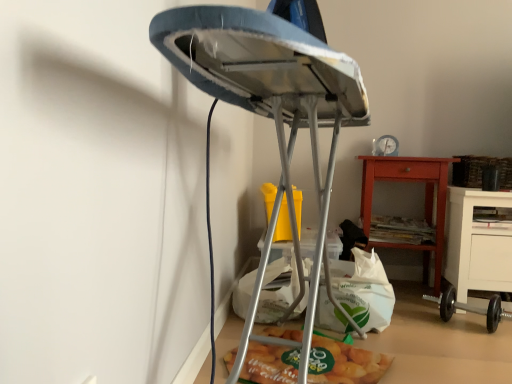
Question: From a real-world perspective, is matte plastic bag of chips at lower center beneath white paper bag at lower center?

Choices:
 (A) no
 (B) yes

Answer: (B)

Question: Is the position of matte plastic bag of chips at lower center more distant than that of white paper bag at lower center?

Choices:
 (A) no
 (B) yes

Answer: (A)

Question: Can you confirm if matte plastic bag of chips at lower center is positioned to the right of white paper bag at lower center?

Choices:
 (A) yes
 (B) no

Answer: (B)

Question: From the image's perspective, would you say matte plastic bag of chips at lower center is shown under white paper bag at lower center?

Choices:
 (A) no
 (B) yes

Answer: (B)

Question: Is matte plastic bag of chips at lower center surrounding white paper bag at lower center?

Choices:
 (A) no
 (B) yes

Answer: (A)

Question: Is white paper bag at lower center to the left or to the right of matte orange wooden nightstand at lower right in the image?

Choices:
 (A) left
 (B) right

Answer: (A)

Question: From a real-world perspective, is white paper bag at lower center above or below matte orange wooden nightstand at lower right?

Choices:
 (A) above
 (B) below

Answer: (B)

Question: Relative to matte orange wooden nightstand at lower right, is white paper bag at lower center in front or behind?

Choices:
 (A) front
 (B) behind

Answer: (A)

Question: Considering the positions of point (376, 279) and point (432, 188), is point (376, 279) closer or farther from the camera than point (432, 188)?

Choices:
 (A) closer
 (B) farther

Answer: (A)

Question: Relative to metallic ironing board at center, is white paper bag at lower center in front or behind?

Choices:
 (A) behind
 (B) front

Answer: (A)

Question: Is white paper bag at lower center to the left or to the right of metallic ironing board at center in the image?

Choices:
 (A) left
 (B) right

Answer: (B)

Question: Based on their sizes in the image, would you say white paper bag at lower center is bigger or smaller than metallic ironing board at center?

Choices:
 (A) small
 (B) big

Answer: (A)

Question: Does point (370, 281) appear closer or farther from the camera than point (266, 340)?

Choices:
 (A) farther
 (B) closer

Answer: (A)

Question: Is matte plastic bag of chips at lower center inside the boundaries of black rubber dumbbell at lower right, or outside?

Choices:
 (A) outside
 (B) inside

Answer: (A)

Question: Is matte plastic bag of chips at lower center wider or thinner than black rubber dumbbell at lower right?

Choices:
 (A) thin
 (B) wide

Answer: (B)